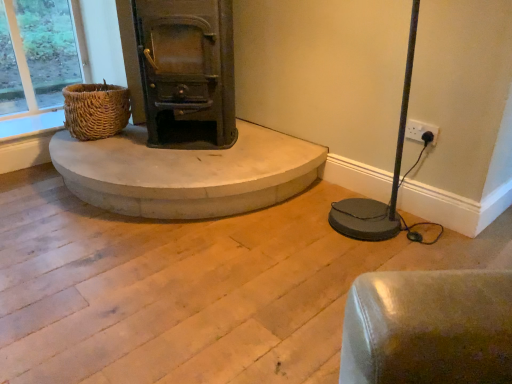
Question: Does smooth concrete hearth at center lie in front of woven brown basket at left?

Choices:
 (A) yes
 (B) no

Answer: (A)

Question: Is smooth concrete hearth at center facing away from woven brown basket at left?

Choices:
 (A) no
 (B) yes

Answer: (A)

Question: Considering the relative positions of smooth concrete hearth at center and woven brown basket at left in the image provided, is smooth concrete hearth at center to the right of woven brown basket at left from the viewer's perspective?

Choices:
 (A) no
 (B) yes

Answer: (B)

Question: From the image's perspective, is smooth concrete hearth at center above woven brown basket at left?

Choices:
 (A) yes
 (B) no

Answer: (B)

Question: Is smooth concrete hearth at center taller than woven brown basket at left?

Choices:
 (A) no
 (B) yes

Answer: (A)

Question: Does smooth concrete hearth at center appear on the left side of woven brown basket at left?

Choices:
 (A) yes
 (B) no

Answer: (B)

Question: Is woven brown basket at left bigger than smooth concrete hearth at center?

Choices:
 (A) yes
 (B) no

Answer: (B)

Question: Considering the relative sizes of woven brown basket at left and smooth concrete hearth at center in the image provided, is woven brown basket at left thinner than smooth concrete hearth at center?

Choices:
 (A) yes
 (B) no

Answer: (A)

Question: Considering the relative positions of woven brown basket at left and smooth concrete hearth at center in the image provided, is woven brown basket at left in front of smooth concrete hearth at center?

Choices:
 (A) no
 (B) yes

Answer: (A)

Question: Is woven brown basket at left wider than smooth concrete hearth at center?

Choices:
 (A) no
 (B) yes

Answer: (A)

Question: Considering the relative positions of woven brown basket at left and smooth concrete hearth at center in the image provided, is woven brown basket at left to the left of smooth concrete hearth at center from the viewer's perspective?

Choices:
 (A) no
 (B) yes

Answer: (B)

Question: Is woven brown basket at left aimed at smooth concrete hearth at center?

Choices:
 (A) yes
 (B) no

Answer: (A)

Question: From a real-world perspective, is smooth concrete hearth at center positioned above or below woven brown basket at left?

Choices:
 (A) below
 (B) above

Answer: (A)